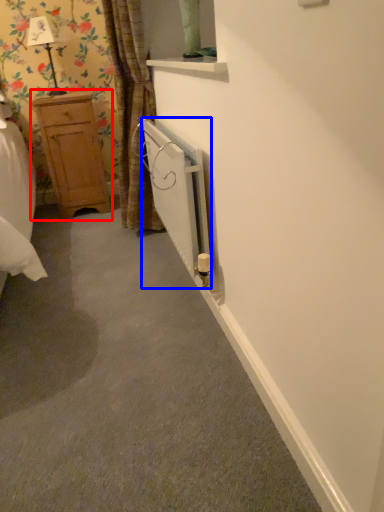
Question: Among these objects, which one is farthest to the camera, dresser (highlighted by a red box) or radiator (highlighted by a blue box)?

Choices:
 (A) dresser
 (B) radiator

Answer: (A)